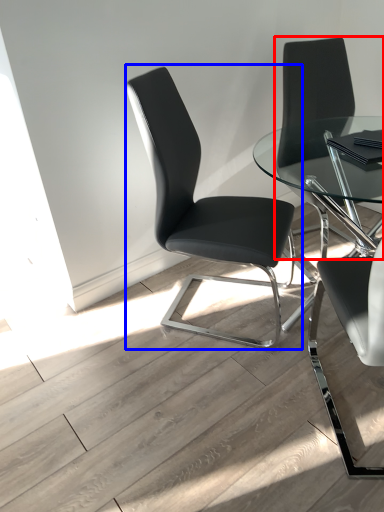
Question: Which of the following is the farthest to the observer, chair (highlighted by a red box) or chair (highlighted by a blue box)?

Choices:
 (A) chair
 (B) chair

Answer: (A)